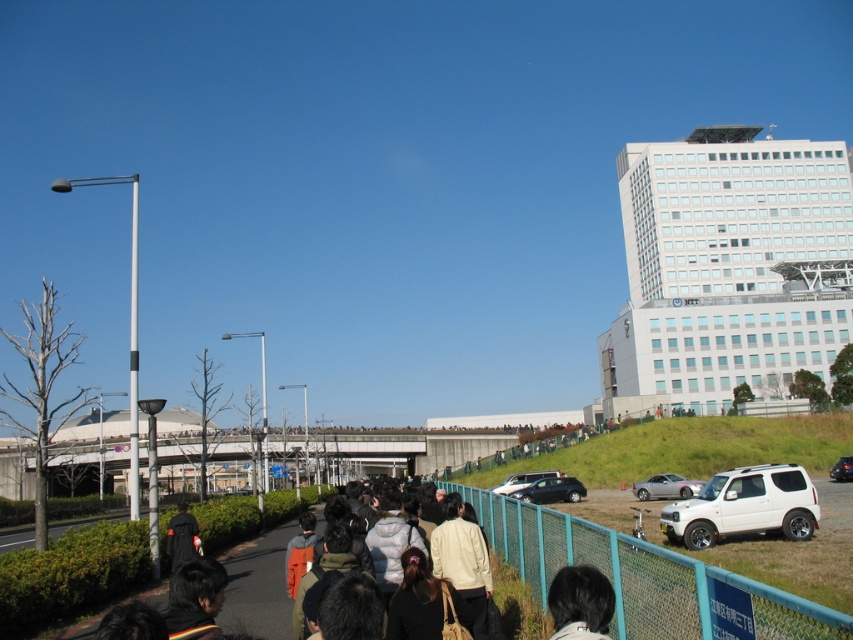
Question: Which point is closer to the camera taking this photo?

Choices:
 (A) (114, 621)
 (B) (672, 518)
 (C) (189, 552)

Answer: (A)

Question: Can you confirm if satin silver car at lower right is positioned above satin silver car at lower center?

Choices:
 (A) yes
 (B) no

Answer: (A)

Question: Which object is farther from the camera taking this photo?

Choices:
 (A) satin silver car at lower center
 (B) black hair at lower center
 (C) light beige jacket at center

Answer: (A)

Question: In this image, where is white matte suv at lower right located relative to dark hair at lower left?

Choices:
 (A) below
 (B) above

Answer: (A)

Question: Which of these objects is positioned farthest from the black matte suv at center?

Choices:
 (A) matte black car at center
 (B) white matte suv at lower right
 (C) satin silver car at lower center
 (D) satin silver car at lower right

Answer: (B)

Question: Can you confirm if light beige jacket at center is thinner than black hair at lower center?

Choices:
 (A) yes
 (B) no

Answer: (B)